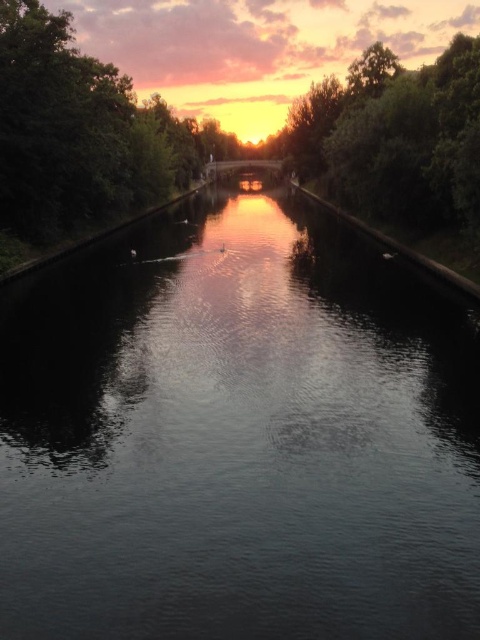
Question: Does dark reflective water at center come behind green leafy tree at center?

Choices:
 (A) no
 (B) yes

Answer: (A)

Question: Can you confirm if dark reflective water at center is positioned to the left of green leafy tree at center?

Choices:
 (A) yes
 (B) no

Answer: (A)

Question: Does dark reflective water at center have a greater width compared to green leafy tree at center?

Choices:
 (A) no
 (B) yes

Answer: (A)

Question: Which point is closer to the camera?

Choices:
 (A) (307, 556)
 (B) (396, 81)

Answer: (A)